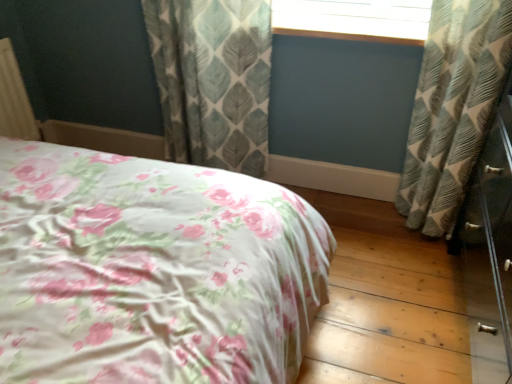
Question: Is textured gray-green leaf-patterned curtain at center, which is the first curtain from left to right, at the left side of textured gray-green curtain at right, arranged as the first curtain when viewed from the right?

Choices:
 (A) no
 (B) yes

Answer: (B)

Question: Is textured gray-green leaf-patterned curtain at center, which is the first curtain from left to right, facing away from textured gray-green curtain at right, arranged as the second curtain when viewed from the left?

Choices:
 (A) no
 (B) yes

Answer: (A)

Question: Is textured gray-green leaf-patterned curtain at center, which is the first curtain from left to right, not within textured gray-green curtain at right, arranged as the second curtain when viewed from the left?

Choices:
 (A) no
 (B) yes

Answer: (B)

Question: Considering the relative sizes of textured gray-green leaf-patterned curtain at center, positioned as the 2th curtain in right-to-left order, and textured gray-green curtain at right, arranged as the second curtain when viewed from the left, in the image provided, is textured gray-green leaf-patterned curtain at center, positioned as the 2th curtain in right-to-left order, wider than textured gray-green curtain at right, arranged as the second curtain when viewed from the left,?

Choices:
 (A) yes
 (B) no

Answer: (B)

Question: Is textured gray-green leaf-patterned curtain at center, positioned as the 2th curtain in right-to-left order, aimed at textured gray-green curtain at right, arranged as the first curtain when viewed from the right?

Choices:
 (A) no
 (B) yes

Answer: (A)

Question: Is point (143, 314) positioned closer to the camera than point (347, 6)?

Choices:
 (A) farther
 (B) closer

Answer: (B)

Question: Looking at their shapes, would you say floral fabric bed at center is wider or thinner than wooden window frame at upper center?

Choices:
 (A) wide
 (B) thin

Answer: (A)

Question: Relative to wooden window frame at upper center, is floral fabric bed at center in front or behind?

Choices:
 (A) front
 (B) behind

Answer: (A)

Question: Is floral fabric bed at center to the left or to the right of wooden window frame at upper center in the image?

Choices:
 (A) right
 (B) left

Answer: (B)

Question: From the image's perspective, is wooden window frame at upper center located above or below textured gray-green leaf-patterned curtain at center, positioned as the 2th curtain in right-to-left order?

Choices:
 (A) above
 (B) below

Answer: (A)

Question: In the image, is wooden window frame at upper center positioned in front of or behind textured gray-green leaf-patterned curtain at center, which is the first curtain from left to right?

Choices:
 (A) behind
 (B) front

Answer: (A)

Question: Considering the positions of point (317, 34) and point (251, 38), is point (317, 34) closer or farther from the camera than point (251, 38)?

Choices:
 (A) closer
 (B) farther

Answer: (A)

Question: Do you think wooden window frame at upper center is within textured gray-green leaf-patterned curtain at center, positioned as the 2th curtain in right-to-left order, or outside of it?

Choices:
 (A) outside
 (B) inside

Answer: (A)

Question: From the image's perspective, relative to floral fabric bed at center, is textured gray-green curtain at right, arranged as the first curtain when viewed from the right, above or below?

Choices:
 (A) below
 (B) above

Answer: (B)

Question: In the image, is textured gray-green curtain at right, arranged as the first curtain when viewed from the right, positioned in front of or behind floral fabric bed at center?

Choices:
 (A) front
 (B) behind

Answer: (B)